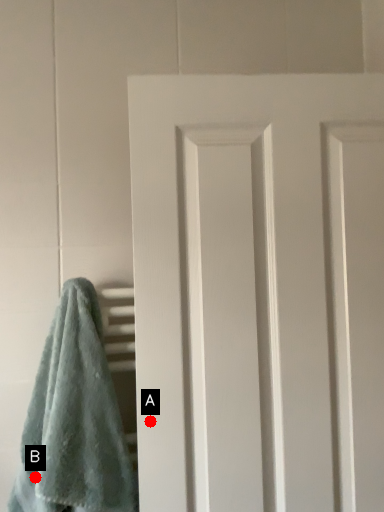
Question: Two points are circled on the image, labeled by A and B beside each circle. Which point is farther from the camera taking this photo?

Choices:
 (A) A is further
 (B) B is further

Answer: (B)